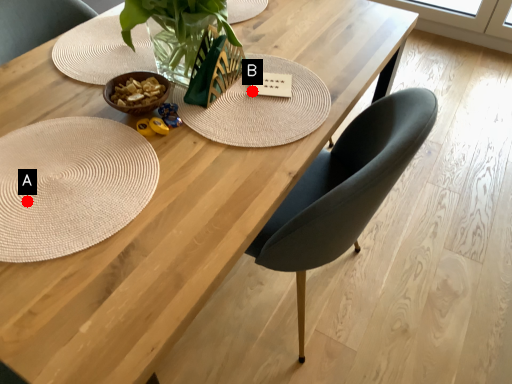
Question: Two points are circled on the image, labeled by A and B beside each circle. Which point is closer to the camera?

Choices:
 (A) A is closer
 (B) B is closer

Answer: (A)